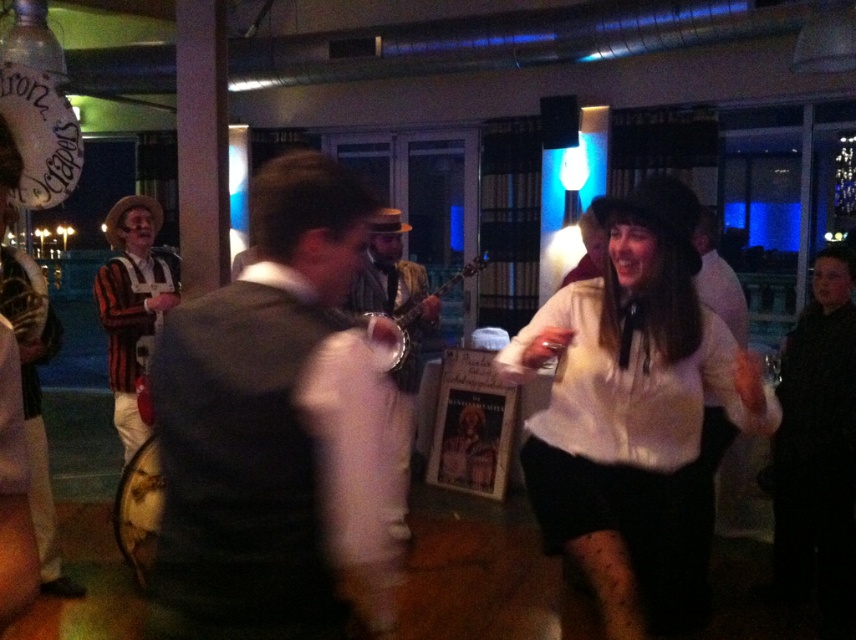
You are a photographer at a party and want to take a photo of the black matte dress at right and the wooden banjo at center. The camera can focus on objects within a 5 feet range. Can you capture both objects in focus without moving the camera?

The black matte dress at right is 5.25 feet away from the wooden banjo at center. Since the camera can only focus within a 5 feet range, the distance between them exceeds the focus range. Therefore, you cannot capture both objects in focus without moving the camera.

You are a photographer at a party and need to capture a photo that includes both the black matte dress at right and the wooden banjo at center. Based on their positions, which object should you focus on first to ensure both are in the frame?

The black matte dress at right is located below the wooden banjo at center, so you should focus on the wooden banjo at center first to ensure both are in the frame.